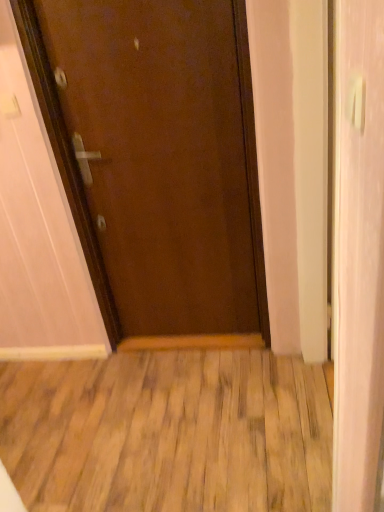
Question: Is white plastic door handle at upper right closer to camera compared to brown matte door at center?

Choices:
 (A) no
 (B) yes

Answer: (B)

Question: From the image's perspective, is white plastic door handle at upper right below brown matte door at center?

Choices:
 (A) yes
 (B) no

Answer: (A)

Question: Considering the relative sizes of white plastic door handle at upper right and brown matte door at center in the image provided, is white plastic door handle at upper right shorter than brown matte door at center?

Choices:
 (A) no
 (B) yes

Answer: (B)

Question: Is white plastic door handle at upper right oriented towards brown matte door at center?

Choices:
 (A) no
 (B) yes

Answer: (A)

Question: From a real-world perspective, is white plastic door handle at upper right located higher than brown matte door at center?

Choices:
 (A) no
 (B) yes

Answer: (B)

Question: Does point (350, 121) appear closer or farther from the camera than point (360, 74)?

Choices:
 (A) farther
 (B) closer

Answer: (A)

Question: Considering their positions, is white plastic door handle at upper right located in front of or behind white glossy door at right?

Choices:
 (A) behind
 (B) front

Answer: (B)

Question: Is white plastic door handle at upper right to the left or to the right of white glossy door at right in the image?

Choices:
 (A) left
 (B) right

Answer: (A)

Question: Considering the positions of white plastic door handle at upper right and white glossy door at right in the image, is white plastic door handle at upper right bigger or smaller than white glossy door at right?

Choices:
 (A) big
 (B) small

Answer: (B)

Question: In terms of size, does brown matte door at center appear bigger or smaller than white plastic door handle at upper right?

Choices:
 (A) big
 (B) small

Answer: (A)

Question: Considering the positions of point (248, 197) and point (345, 110), is point (248, 197) closer or farther from the camera than point (345, 110)?

Choices:
 (A) closer
 (B) farther

Answer: (B)

Question: Is brown matte door at center wider or thinner than white plastic door handle at upper right?

Choices:
 (A) thin
 (B) wide

Answer: (B)

Question: Would you say brown matte door at center is inside or outside white plastic door handle at upper right?

Choices:
 (A) outside
 (B) inside

Answer: (A)

Question: Does point (248, 198) appear closer or farther from the camera than point (263, 385)?

Choices:
 (A) closer
 (B) farther

Answer: (A)

Question: Considering the positions of brown matte door at center and wooden floor at center in the image, is brown matte door at center taller or shorter than wooden floor at center?

Choices:
 (A) tall
 (B) short

Answer: (A)